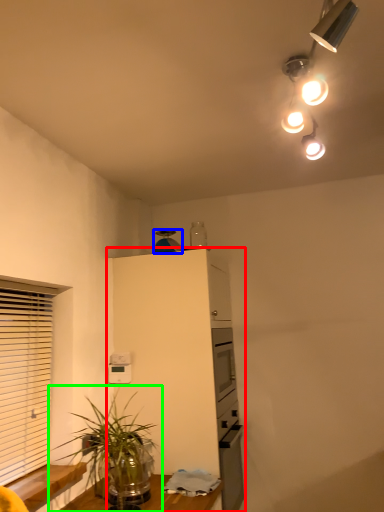
Question: Which object is the closest to the cabinetry (highlighted by a red box)? Choose among these: appliance (highlighted by a blue box) or houseplant (highlighted by a green box).

Choices:
 (A) appliance
 (B) houseplant

Answer: (A)